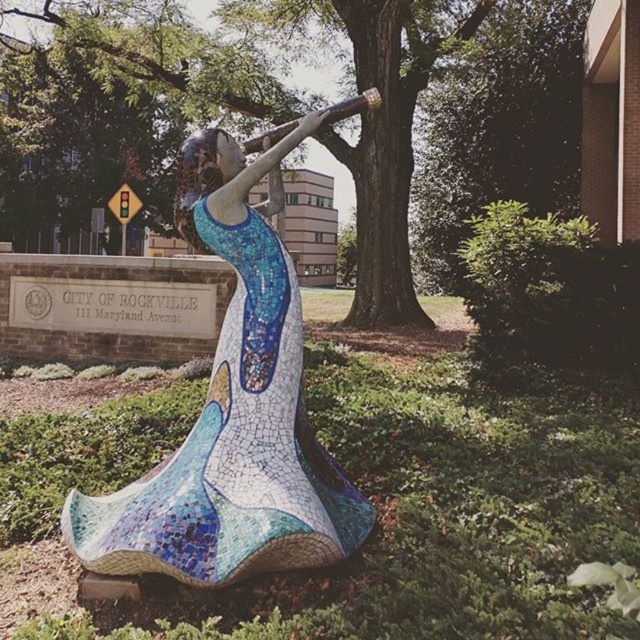
Question: Is mosaic tile woman at center smaller than green leafy tree at center?

Choices:
 (A) yes
 (B) no

Answer: (A)

Question: Is mosaic tile woman at center above green leafy tree at center?

Choices:
 (A) no
 (B) yes

Answer: (A)

Question: Does mosaic tile woman at center have a lesser width compared to green leafy tree at center?

Choices:
 (A) no
 (B) yes

Answer: (B)